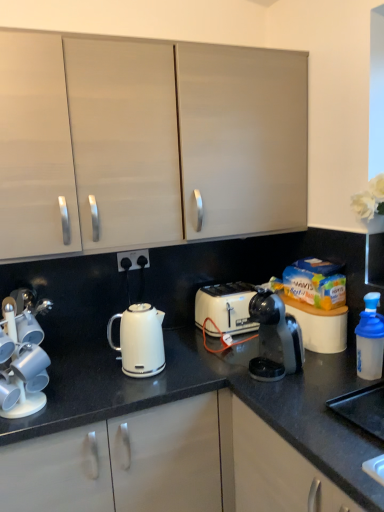
You are a GUI agent. You are given a task and a screenshot of the screen. Output one action in this format:
    pyautogui.click(x=<x>, y=<y>)
    Task: Click on the vacant area that is situated to the right of white glossy cup holder at left
    The height and width of the screenshot is (512, 384).
    Given the screenshot: What is the action you would take?
    pyautogui.click(x=83, y=403)